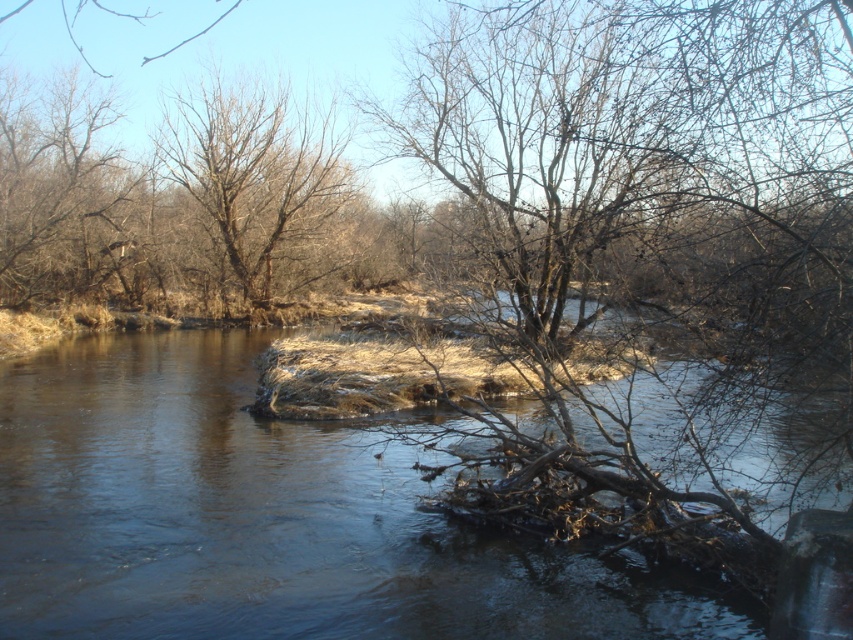
Question: Which of the following is the farthest from the observer?

Choices:
 (A) (82, 388)
 (B) (200, 109)

Answer: (B)

Question: Is clear water at center thinner than brown/dry wood tree at center?

Choices:
 (A) no
 (B) yes

Answer: (A)

Question: Which object is farther from the camera taking this photo?

Choices:
 (A) brown/dry wood tree at center
 (B) clear water at center

Answer: (A)

Question: In this image, where is clear water at center located relative to brown/dry wood tree at center?

Choices:
 (A) below
 (B) above

Answer: (A)

Question: Can you confirm if clear water at center is smaller than brown/dry wood tree at center?

Choices:
 (A) yes
 (B) no

Answer: (B)